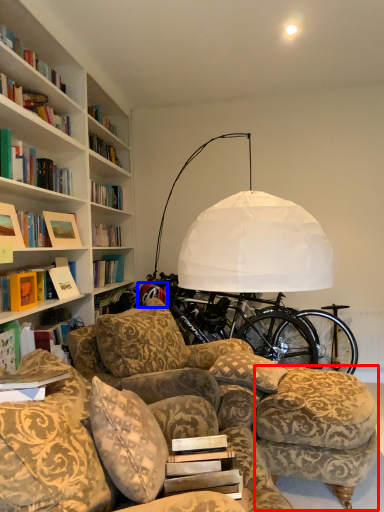
Question: Which point is further to the camera, swivel chair (highlighted by a red box) or wheel (highlighted by a blue box)?

Choices:
 (A) swivel chair
 (B) wheel

Answer: (B)